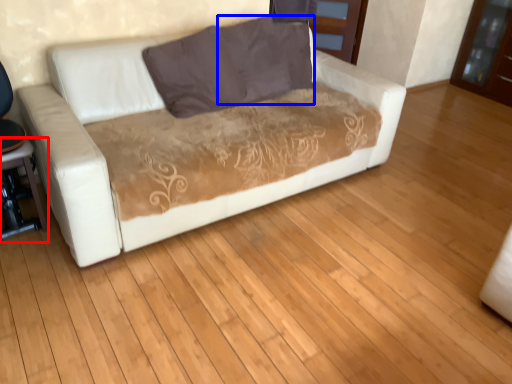
Question: Which point is further to the camera, table (highlighted by a red box) or pillow (highlighted by a blue box)?

Choices:
 (A) table
 (B) pillow

Answer: (B)